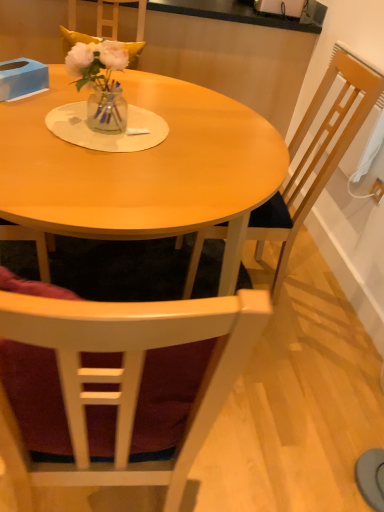
The width and height of the screenshot is (384, 512). I want to click on vacant space underneath translucent glass vase at center (from a real-world perspective), so click(x=103, y=123).